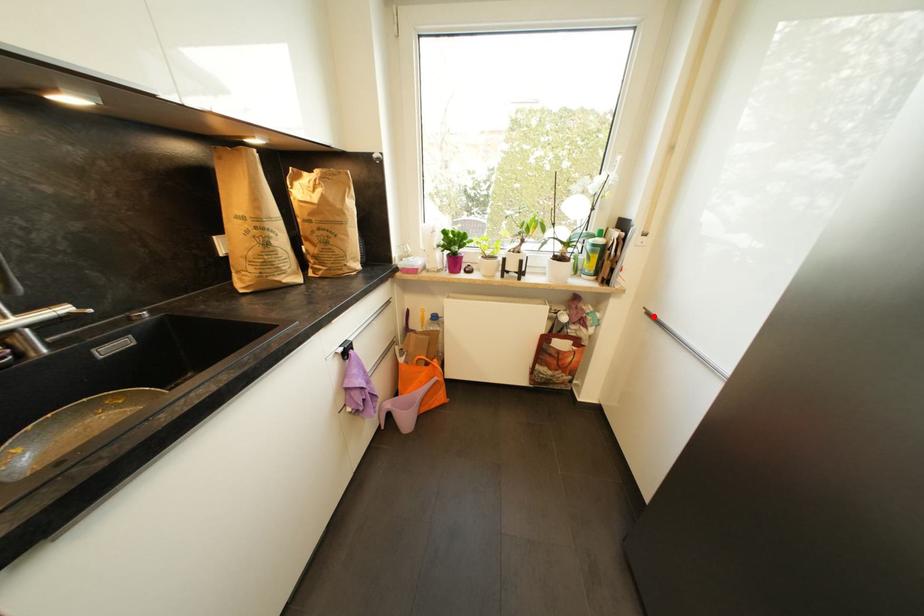
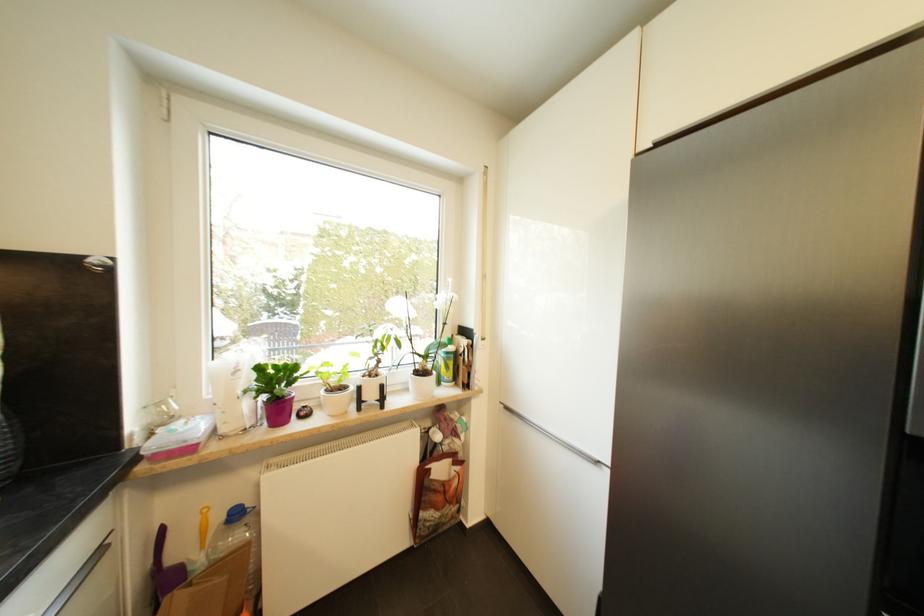
Question: A red point is marked in image1. In image2, is the corresponding 3D point closer to the camera or farther? Reply with the corresponding letter.

Choices:
 (A) The corresponding 3D point is closer.
 (B) The corresponding 3D point is farther.

Answer: (B)